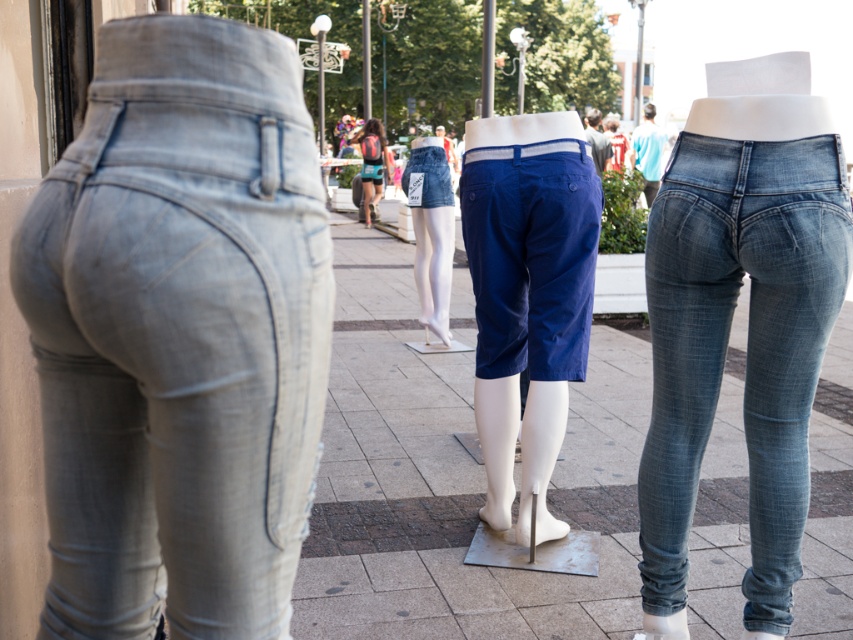
Question: Can you confirm if light gray denim jeans at left is smaller than matte blue shorts at center?

Choices:
 (A) no
 (B) yes

Answer: (B)

Question: Which point is farther from the camera taking this photo?

Choices:
 (A) (511, 221)
 (B) (186, 433)

Answer: (A)

Question: Does denim shorts at center have a greater width compared to denim blue jeans at center?

Choices:
 (A) no
 (B) yes

Answer: (A)

Question: Which of the following is the farthest from the observer?

Choices:
 (A) blue cotton shorts at center
 (B) matte blue shorts at center

Answer: (B)

Question: Where is smooth concrete pavement at center located in relation to denim blue jeans at center in the image?

Choices:
 (A) below
 (B) above

Answer: (A)

Question: Which object is the farthest from the denim shorts at center?

Choices:
 (A) blue cotton shorts at center
 (B) light gray denim jeans at left
 (C) matte blue shorts at center

Answer: (C)